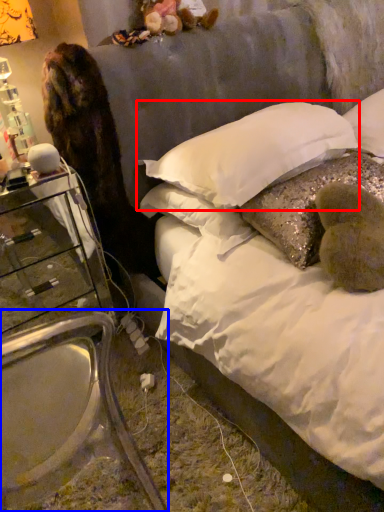
Question: Which object is further to the camera taking this photo, pillow (highlighted by a red box) or armchair (highlighted by a blue box)?

Choices:
 (A) pillow
 (B) armchair

Answer: (A)